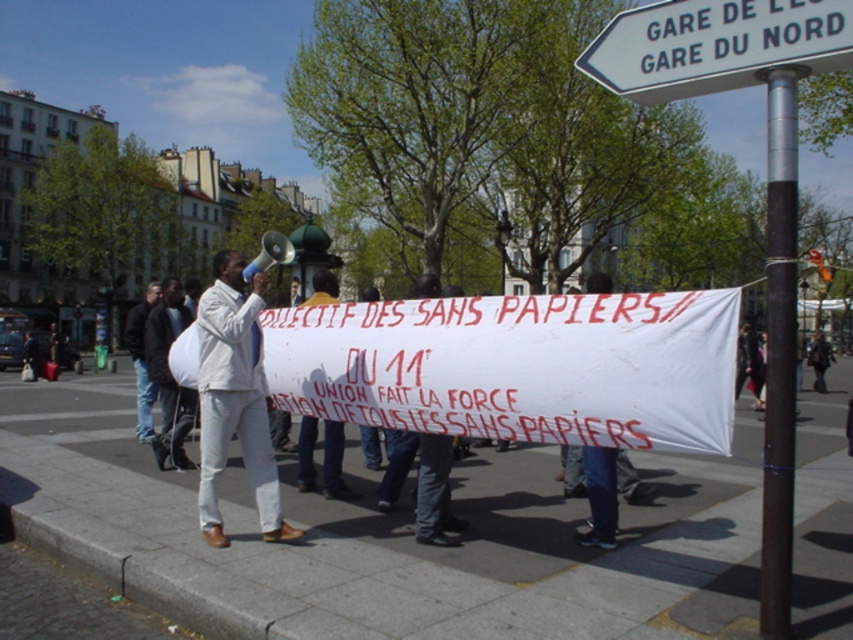
You are a photographer standing at the camera position. You want to take a closeup photo of the point at coordinates point (786,486). Can you reach it with your 100mm lens? Explain why or why not.

The point at coordinates point (786,486) is 3.75 meters away from the camera. A 100mm lens has a focal length that allows for a closeup shot from this distance, so yes, you can take a closeup photo of the point with your 100mm lens.

What is the 2D coordinate of the white plastic sign at upper center in the image?

The white plastic sign at upper center is located at the coordinate point [715,45].

You are a photographer trying to capture the protest scene. You have a camera with a 24mm lens that can capture objects up to 3 meters tall. The white plastic sign at upper center and the dark brown polished metal pole at upper right are in your frame. Can your lens accommodate both objects in terms of height?

The white plastic sign at upper center is shorter than the dark brown polished metal pole at upper right. Since the lens can capture up to 3 meters, and the tallest object is the dark brown polished metal pole at upper right, it will fit within the lens capacity as long as the pole is under 3 meters tall.